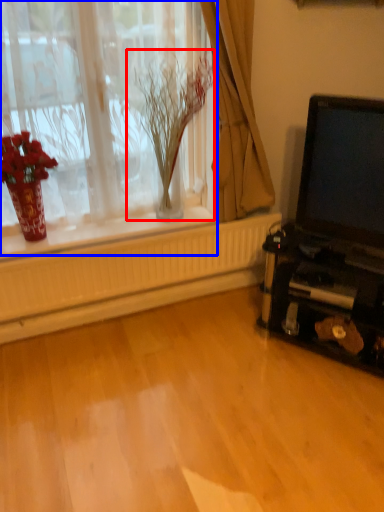
Question: Which object is closer to the camera taking this photo, plant (highlighted by a red box) or window (highlighted by a blue box)?

Choices:
 (A) plant
 (B) window

Answer: (B)